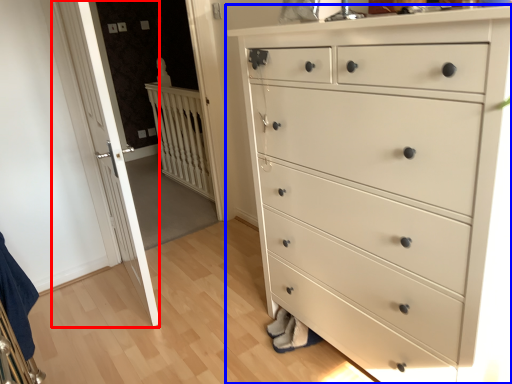
Question: Which object is further to the camera taking this photo, door (highlighted by a red box) or chest of drawers (highlighted by a blue box)?

Choices:
 (A) door
 (B) chest of drawers

Answer: (A)